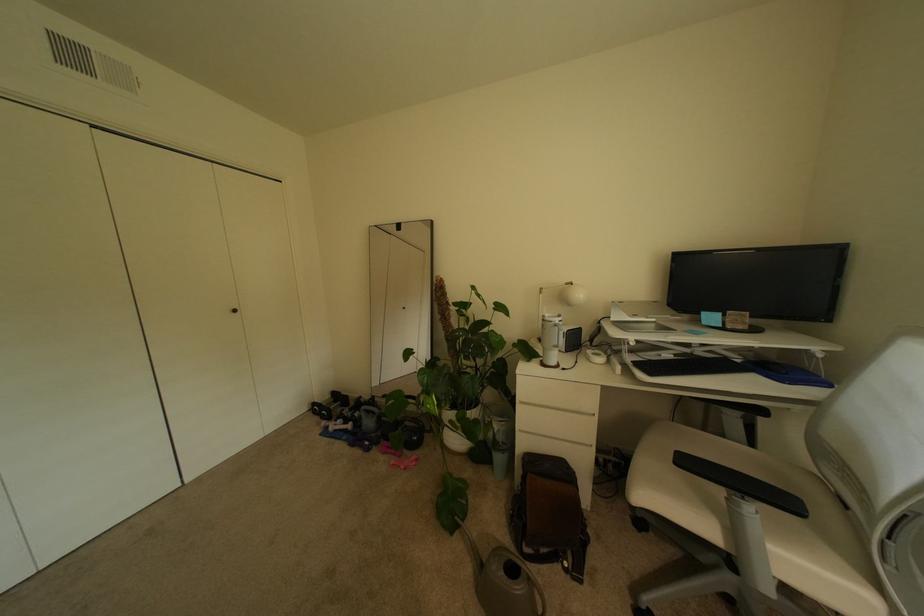
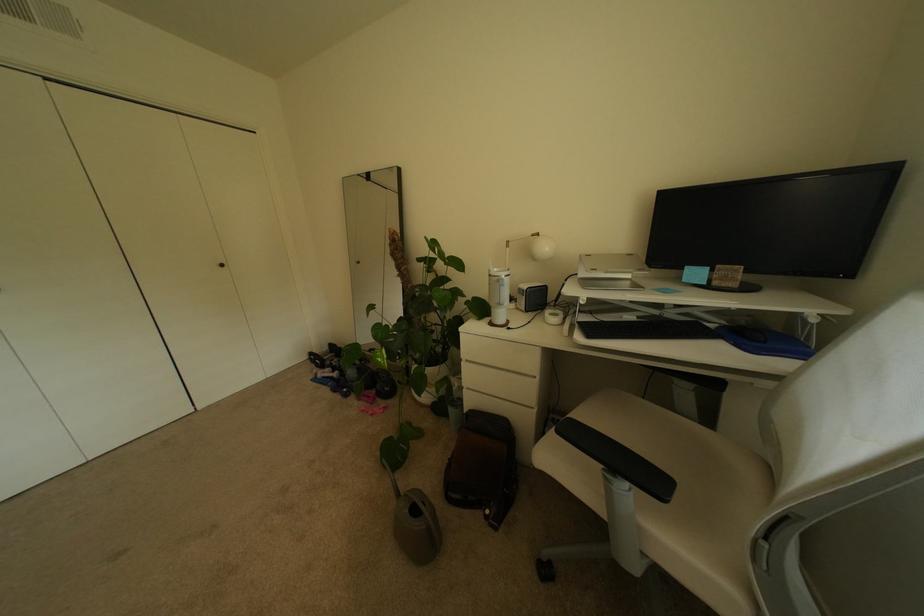
Question: In a continuous first-person perspective shot, in which direction is the camera moving?

Choices:
 (A) Left
 (B) Right
 (C) Forward
 (D) Backward

Answer: (B)